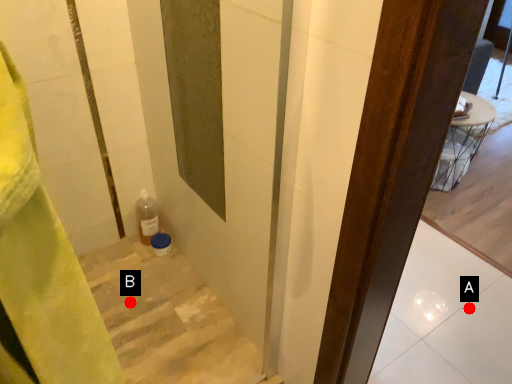
Question: Two points are circled on the image, labeled by A and B beside each circle. Which of the following is the closest to the observer?

Choices:
 (A) A is closer
 (B) B is closer

Answer: (B)